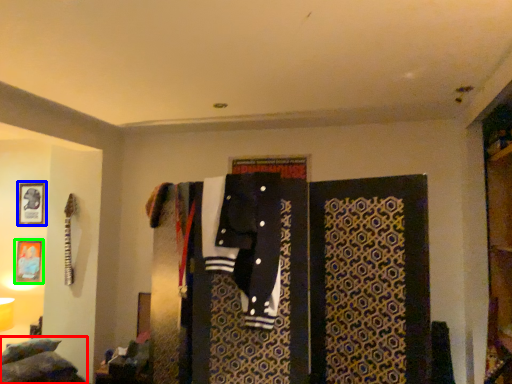
Question: Considering the real-world distances, which object is closest to bed (highlighted by a red box)? picture frame (highlighted by a blue box) or picture frame (highlighted by a green box).

Choices:
 (A) picture frame
 (B) picture frame

Answer: (B)